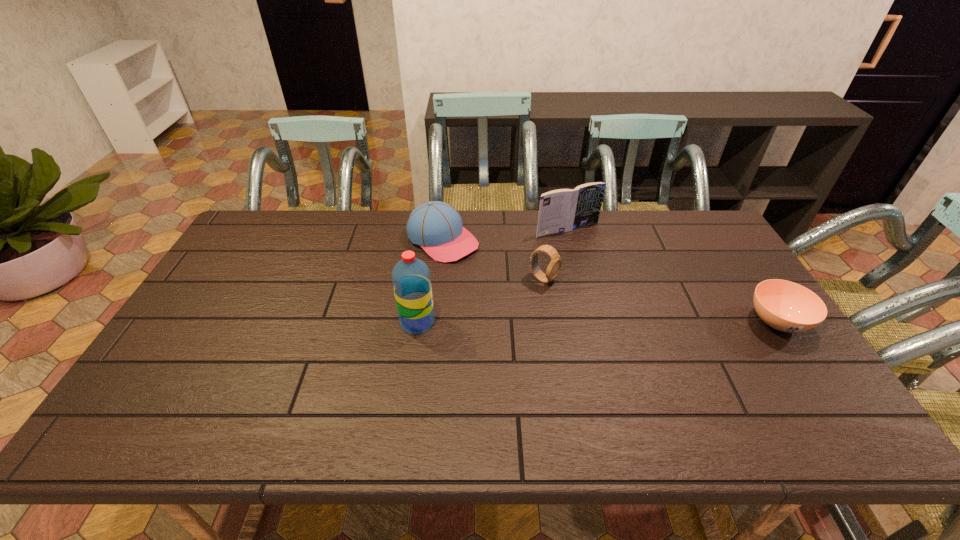
Locate an element on the screen. The height and width of the screenshot is (540, 960). free space located 0.400m on the face of the third nearest object is located at coordinates (690, 355).

Locate an element on the screen. The width and height of the screenshot is (960, 540). free region located on the front cover of the second tallest object is located at coordinates (622, 285).

At what (x,y) coordinates should I click in order to perform the action: click on free location located on the front cover of the second tallest object. Please return your answer as a coordinate pair (x, y). This screenshot has width=960, height=540. Looking at the image, I should click on (635, 298).

Locate an element on the screen. free space located 0.370m on the front cover of the second tallest object is located at coordinates (647, 312).

Image resolution: width=960 pixels, height=540 pixels. In order to click on free region located on the front-facing side of the baseball cap in this screenshot , I will do `click(484, 269)`.

Where is `vacant area situated 0.220m on the front-facing side of the baseball cap`? The height and width of the screenshot is (540, 960). vacant area situated 0.220m on the front-facing side of the baseball cap is located at coordinates (516, 292).

Identify the location of free spot located 0.240m on the front-facing side of the baseball cap. The image size is (960, 540). tap(520, 295).

Where is `book at the far edge`? Image resolution: width=960 pixels, height=540 pixels. book at the far edge is located at coordinates (562, 210).

This screenshot has height=540, width=960. I want to click on baseball cap that is at the far edge, so click(437, 227).

Locate an element on the screen. object present at the right edge is located at coordinates (786, 306).